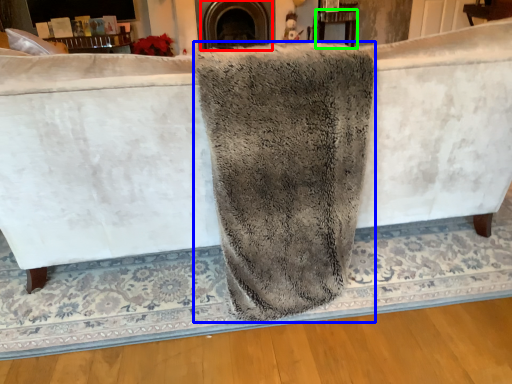
Question: Estimate the real-world distances between objects in this image. Which object is closer to fireplace (highlighted by a red box), bath towel (highlighted by a blue box) or table (highlighted by a green box)?

Choices:
 (A) bath towel
 (B) table

Answer: (B)